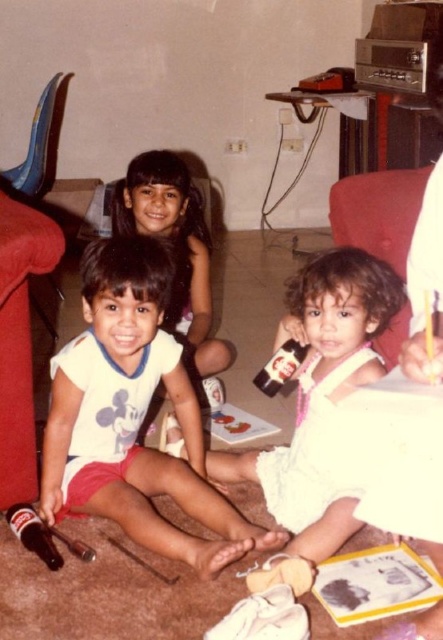
Is white cotton shirt at center wider than white cotton dress at center?

No.

Who is more forward, (175, 548) or (272, 493)?

Point (175, 548)

The image size is (443, 640). Find the location of `white cotton shirt at center`. white cotton shirt at center is located at coordinates (132, 416).

Which of these two, white cotton shirt at center or translucent glass soda at lower left, stands taller?

white cotton shirt at center is taller.

Does white cotton shirt at center appear on the right side of translucent glass soda at lower left?

Yes, white cotton shirt at center is to the right of translucent glass soda at lower left.

Who is more forward, (202, 444) or (35, 531)?

Point (35, 531) is in front.

This screenshot has width=443, height=640. Find the location of `white cotton shirt at center`. white cotton shirt at center is located at coordinates tap(132, 416).

Does white cotton dress at center have a greater width compared to translucent glass soda at lower left?

Yes, white cotton dress at center is wider than translucent glass soda at lower left.

Does white cotton dress at center appear under translucent glass soda at lower left?

Incorrect, white cotton dress at center is not positioned below translucent glass soda at lower left.

Image resolution: width=443 pixels, height=640 pixels. What do you see at coordinates (319, 394) in the screenshot? I see `white cotton dress at center` at bounding box center [319, 394].

This screenshot has height=640, width=443. What are the coordinates of `white cotton dress at center` in the screenshot? It's located at (319, 394).